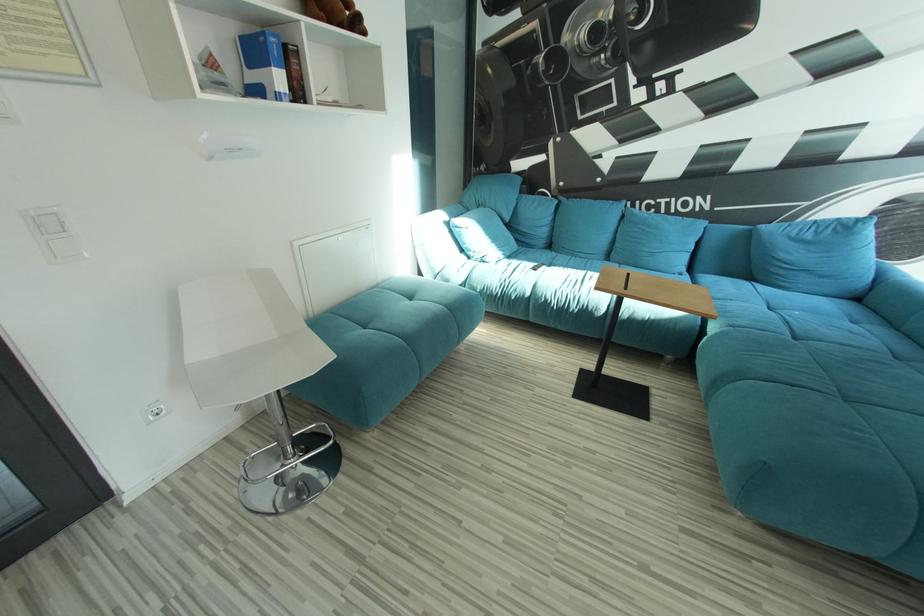
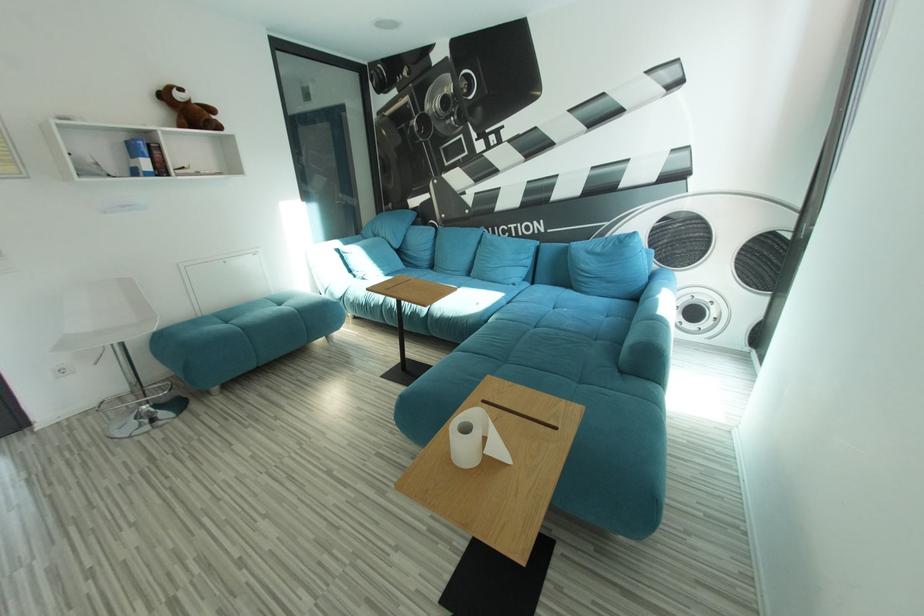
In a continuous first-person perspective shot, in which direction is the camera moving?

The cameraman moved toward right, backward.